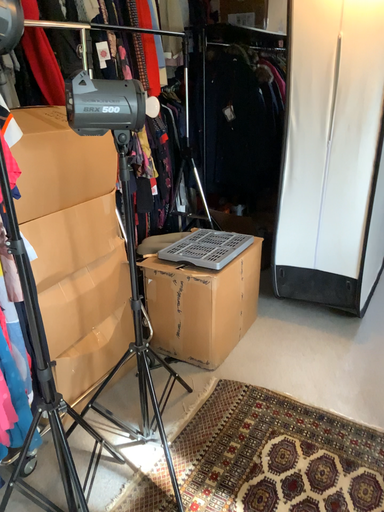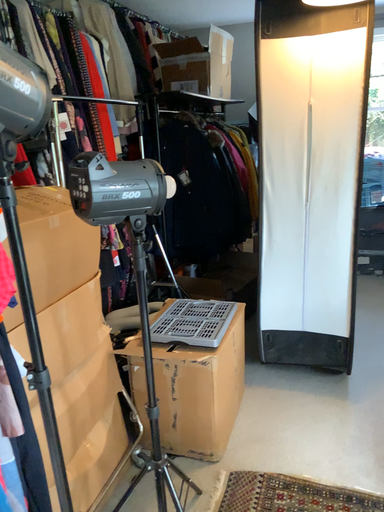
Question: How did the camera likely rotate when shooting the video?

Choices:
 (A) rotated left
 (B) rotated right

Answer: (B)